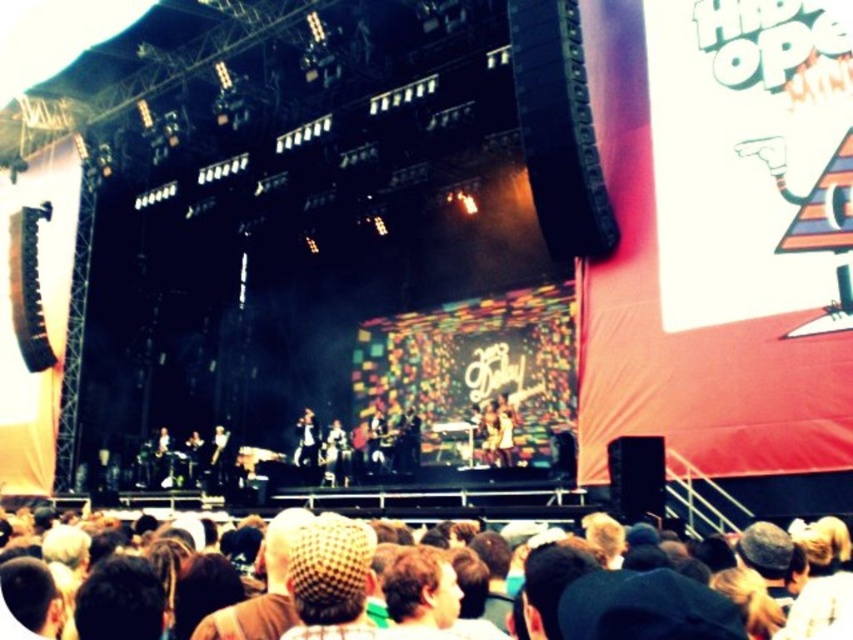
Question: Which of these objects is positioned farthest from the shiny black microphone at center?

Choices:
 (A) shiny silver guitar at center
 (B) black leather jacket at center
 (C) brown hair at center

Answer: (C)

Question: Is shiny black microphone at center in front of shiny silver guitar at center?

Choices:
 (A) yes
 (B) no

Answer: (B)

Question: Which object is closer to the camera taking this photo?

Choices:
 (A) brown hair at center
 (B) shiny black microphone at center
 (C) black leather jacket at center

Answer: (A)

Question: Which point is closer to the camera?

Choices:
 (A) shiny black microphone at center
 (B) shiny silver guitar at center

Answer: (B)

Question: Is black leather jacket at center to the left of shiny black microphone at center from the viewer's perspective?

Choices:
 (A) yes
 (B) no

Answer: (A)

Question: Is the position of black leather jacket at center more distant than that of shiny black microphone at center?

Choices:
 (A) yes
 (B) no

Answer: (A)